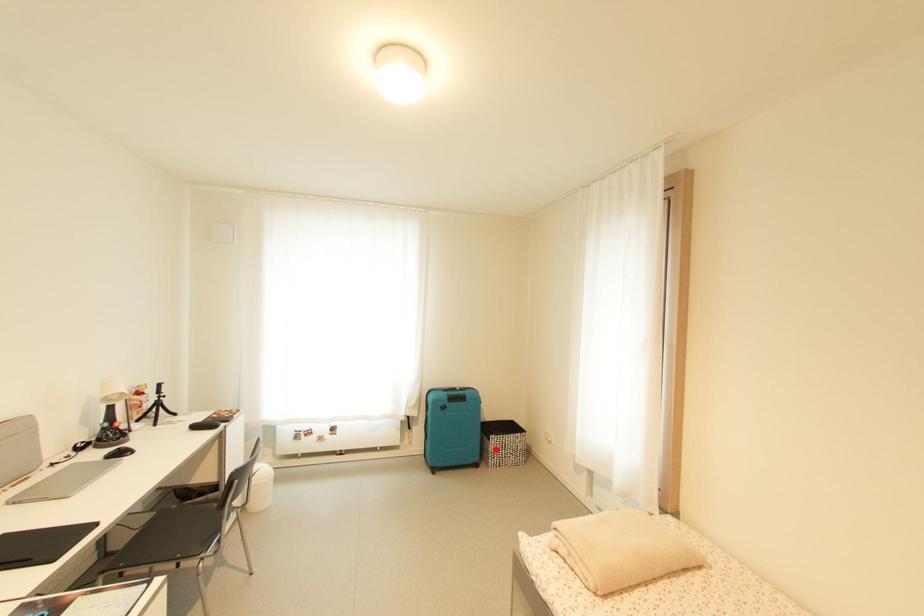
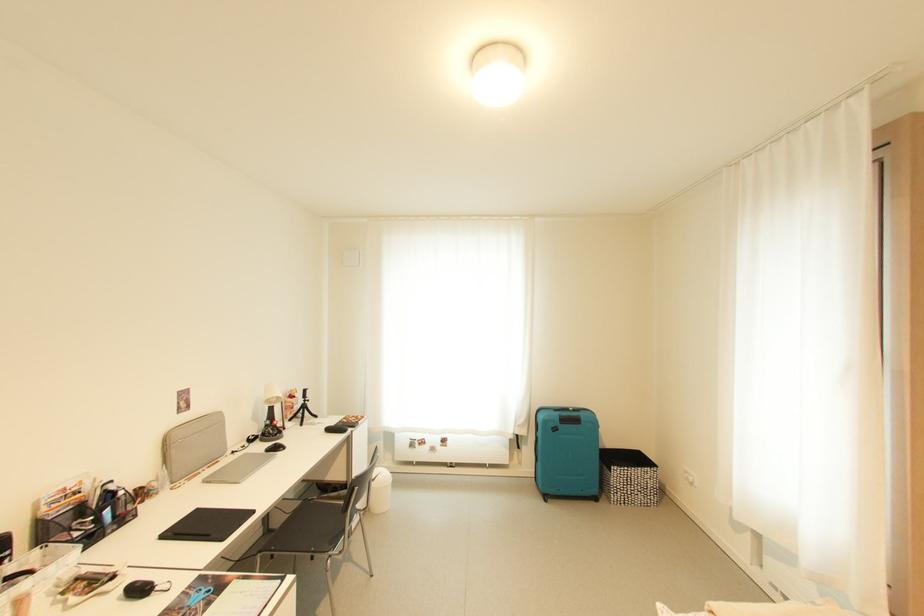
Locate, in the second image, the point that corresponds to the highlighted location in the first image.

(617, 482)